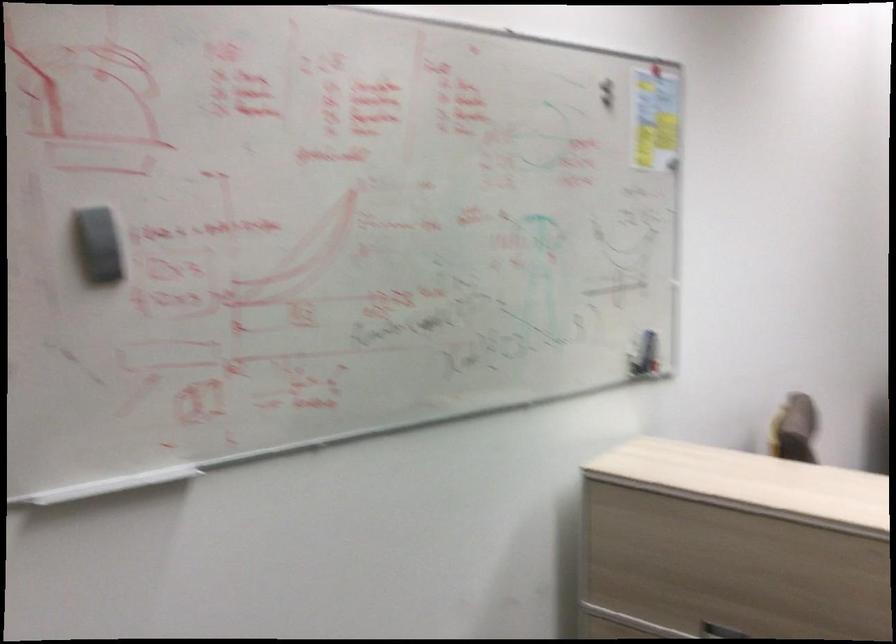
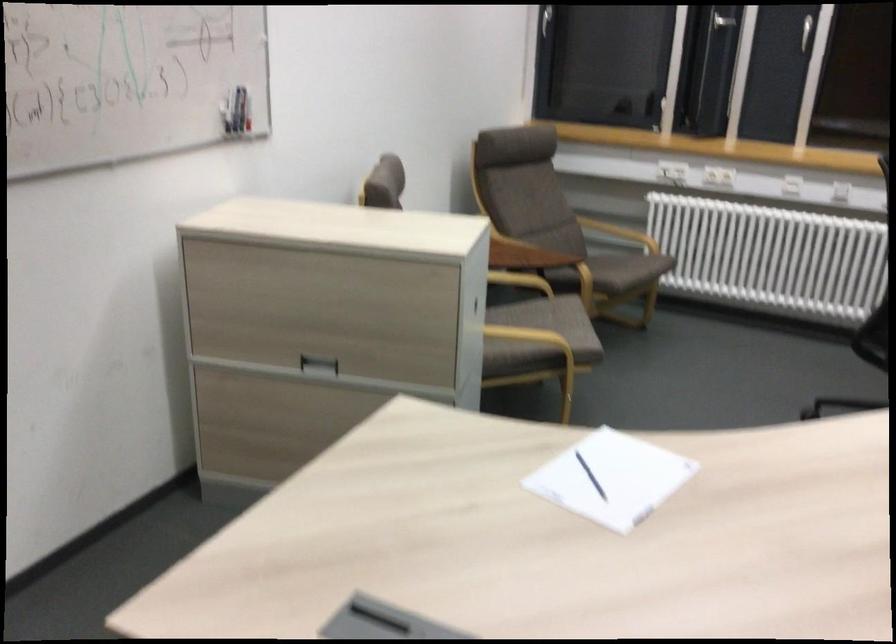
The point at (x=661, y=350) is marked in the first image. Where is the corresponding point in the second image?

(248, 114)